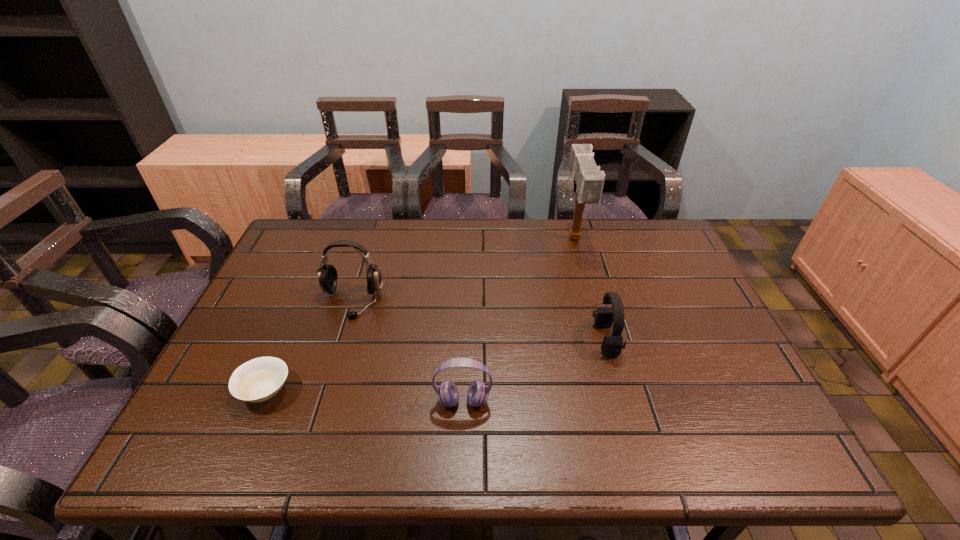
In the image, there is a desktop. Identify the location of free space at the left edge. (300, 299).

Locate an element on the screen. vacant space at the right edge is located at coordinates (690, 333).

This screenshot has height=540, width=960. Find the location of `vacant region at the near left corner of the desktop`. vacant region at the near left corner of the desktop is located at coordinates (193, 442).

The image size is (960, 540). Identify the location of vacant space at the far right corner of the desktop. (660, 242).

I want to click on vacant space at the near right corner, so click(768, 430).

Locate an element on the screen. free area in between the farthest object and the shortest object is located at coordinates (420, 314).

Identify the location of free space between the nearest headset and the fourth shortest object. (407, 352).

Locate an element on the screen. vacant space in between the second headset from left to right and the shortest object is located at coordinates (364, 396).

What are the coordinates of `free space between the tallest object and the third object from left to right` in the screenshot? It's located at (518, 320).

Locate an element on the screen. Image resolution: width=960 pixels, height=540 pixels. empty location between the third nearest object and the nearest headset is located at coordinates (535, 370).